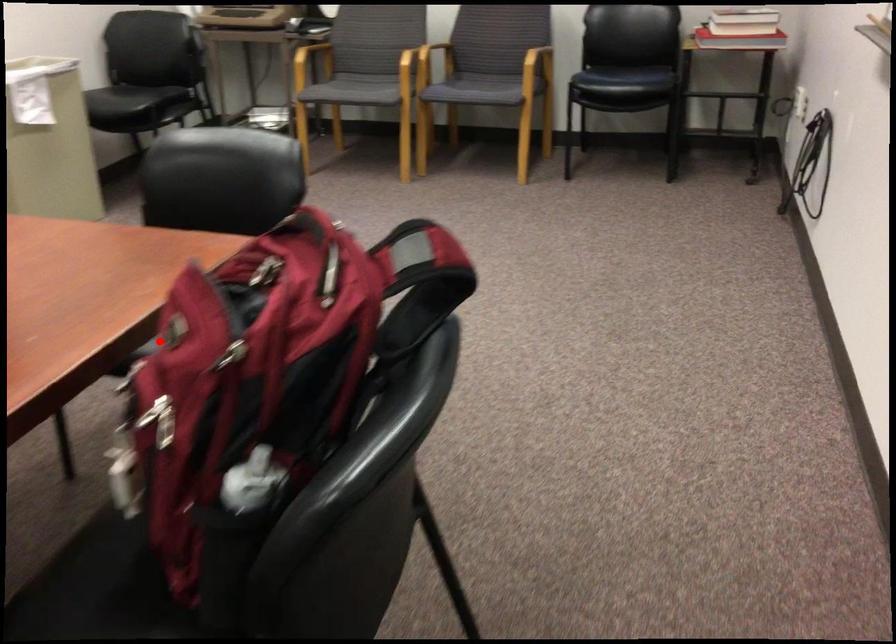
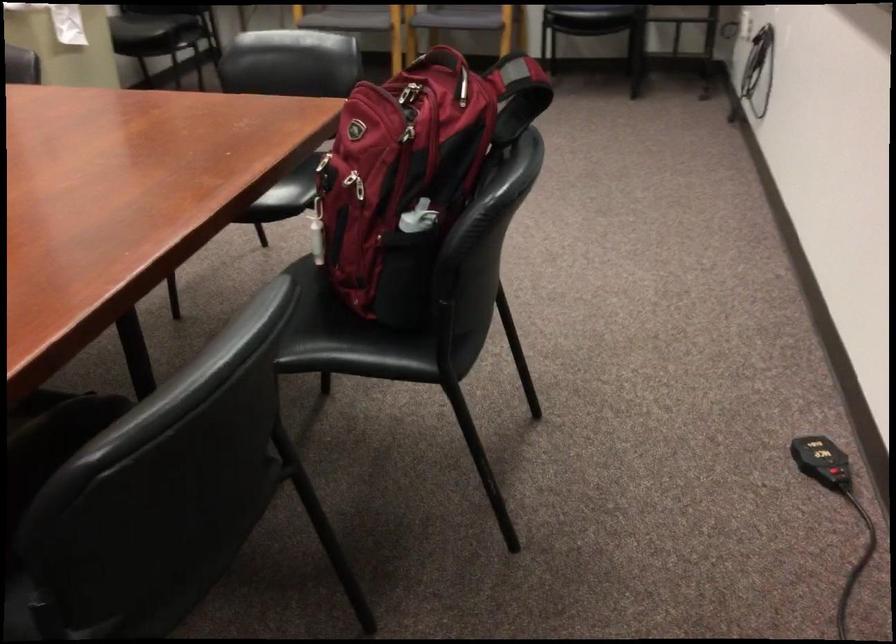
Question: I am providing you with two images of the same scene from different viewpoints. A red point is shown in image1. For the corresponding object point in image2, is it positioned nearer or farther from the camera?

Choices:
 (A) Nearer
 (B) Farther

Answer: (B)